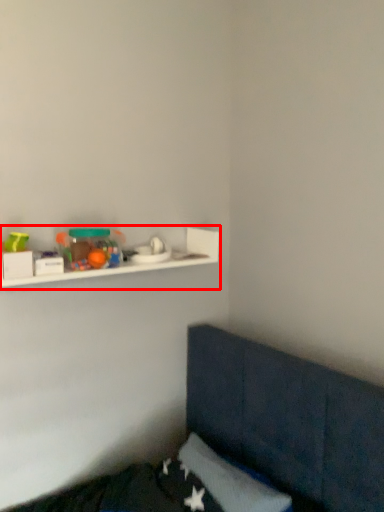
Question: From the image's perspective, what is the correct spatial positioning of shelf (annotated by the red box) in reference to toy?

Choices:
 (A) below
 (B) above

Answer: (A)